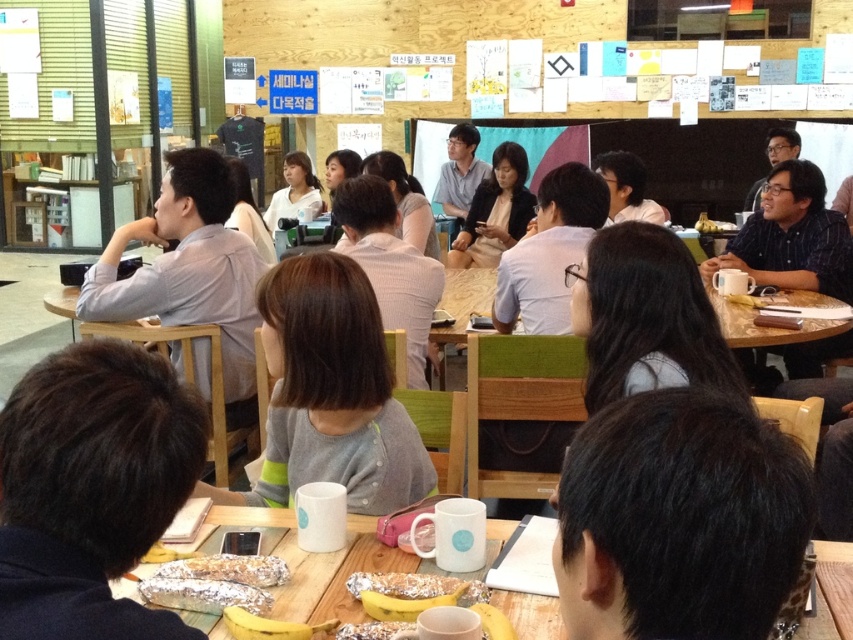
Consider the image. You are a photographer at the back of the room. You want to take a photo of the gray shirt at left and the matte white shirt at upper center without any obstruction. Can you see both of them clearly?

The gray shirt at left is positioned under the matte white shirt at upper center, so the gray shirt at left might be partially blocked by the matte white shirt at upper center. Therefore, you might not be able to see both clearly without moving closer or adjusting the angle.

You are standing at the entrance of the room and want to locate the black matte glasses at upper right. According to the coordinates provided, where should you look relative to the room?

The black matte glasses at upper right are located at coordinates point (781,145), which means they are positioned 22.7 percent from the left edge and 91.7 percent from the bottom edge of the room. So you should look towards the upper right corner, closer to the right wall and near the top.